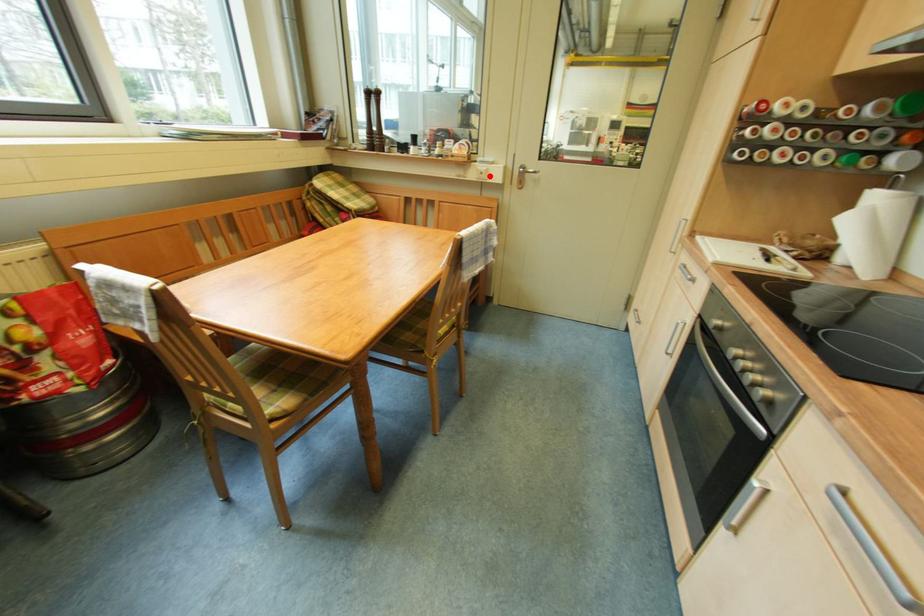
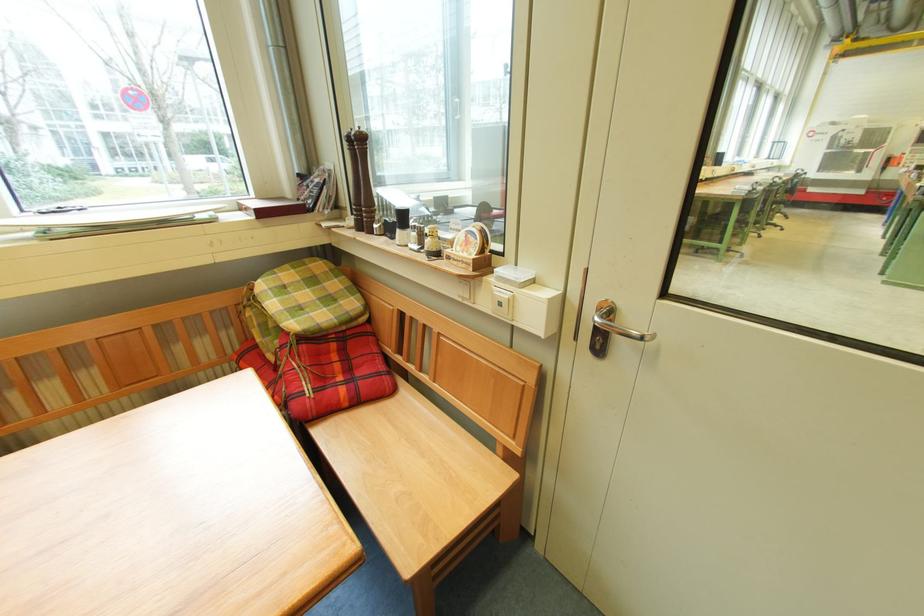
Question: I am providing you with two images of the same scene from different viewpoints. In image1, a red point is highlighted. Considering the same 3D point in image2, which of the following is correct?

Choices:
 (A) It is closer
 (B) It is farther

Answer: (B)